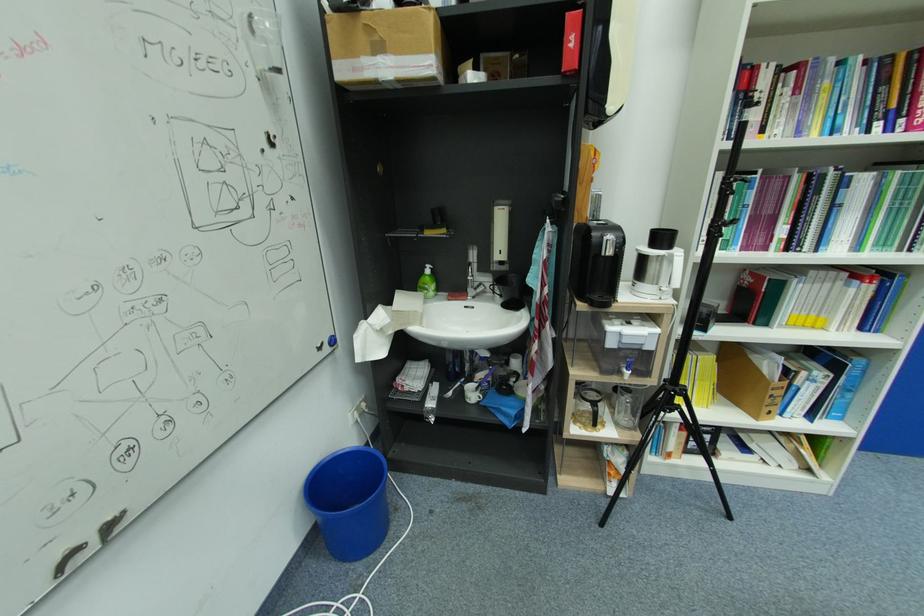
What do you see at coordinates (484, 392) in the screenshot? I see `the white mug handle` at bounding box center [484, 392].